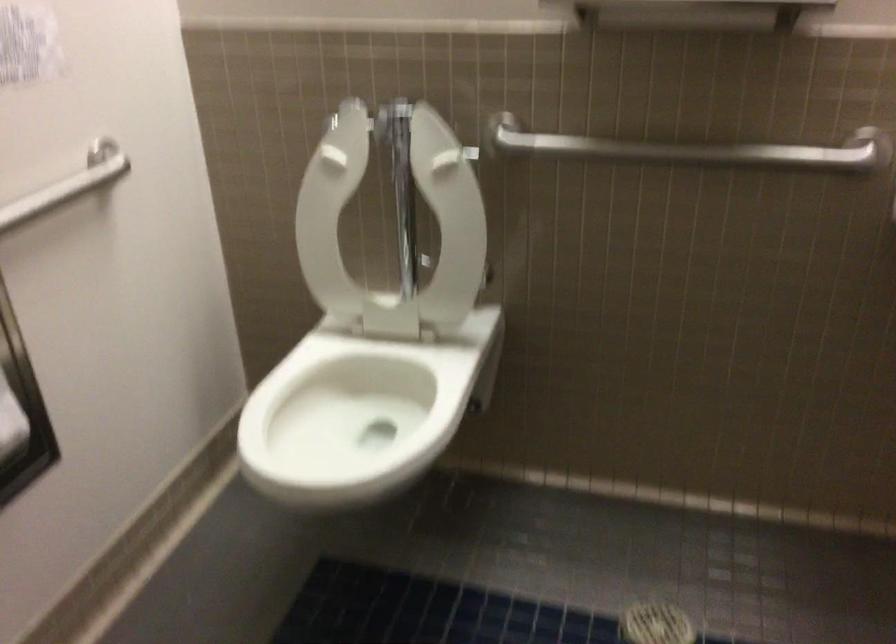
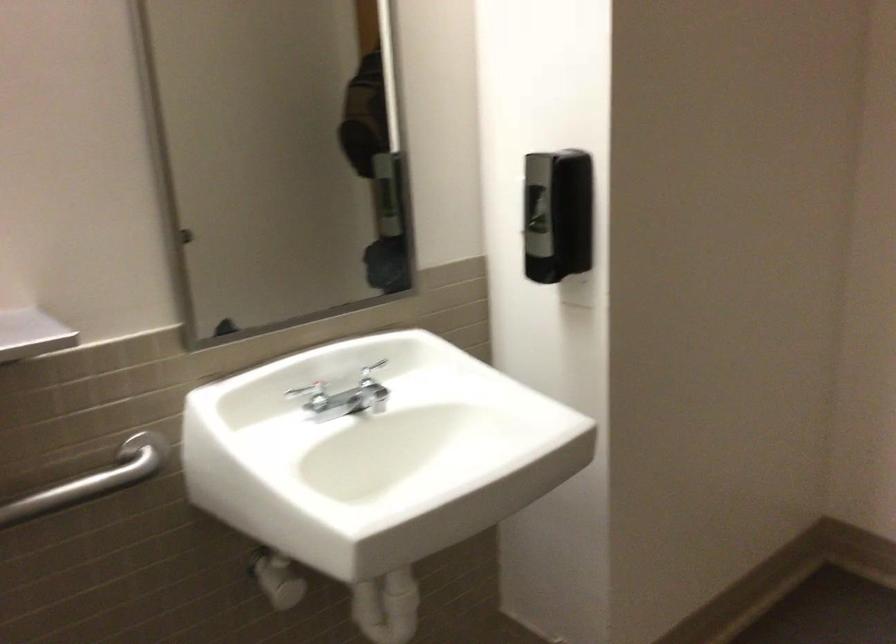
Question: The camera is either moving clockwise (left) or counter-clockwise (right) around the object. The first image is from the beginning of the video and the second image is from the end. Is the camera moving left or right when shooting the video?

Choices:
 (A) Left
 (B) Right

Answer: (A)